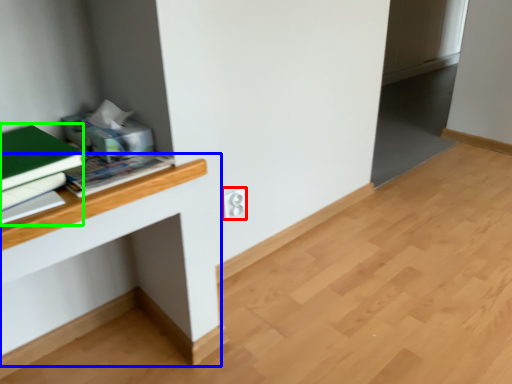
Question: Estimate the real-world distances between objects in this image. Which object is closer to electric outlet (highlighted by a red box), computer desk (highlighted by a blue box) or paperback book (highlighted by a green box)?

Choices:
 (A) computer desk
 (B) paperback book

Answer: (A)